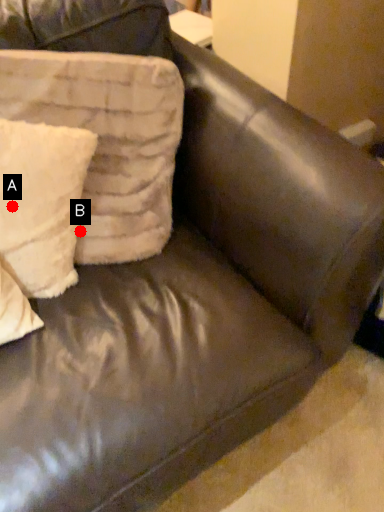
Question: Two points are circled on the image, labeled by A and B beside each circle. Which point is closer to the camera?

Choices:
 (A) A is closer
 (B) B is closer

Answer: (A)